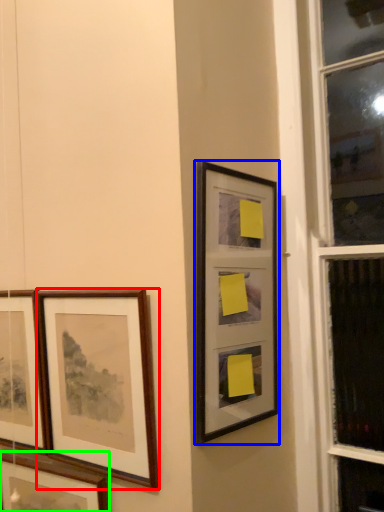
Question: Based on their relative distances, which object is farther from picture frame (highlighted by a red box)? Choose from picture frame (highlighted by a blue box) and picture frame (highlighted by a green box).

Choices:
 (A) picture frame
 (B) picture frame

Answer: (A)